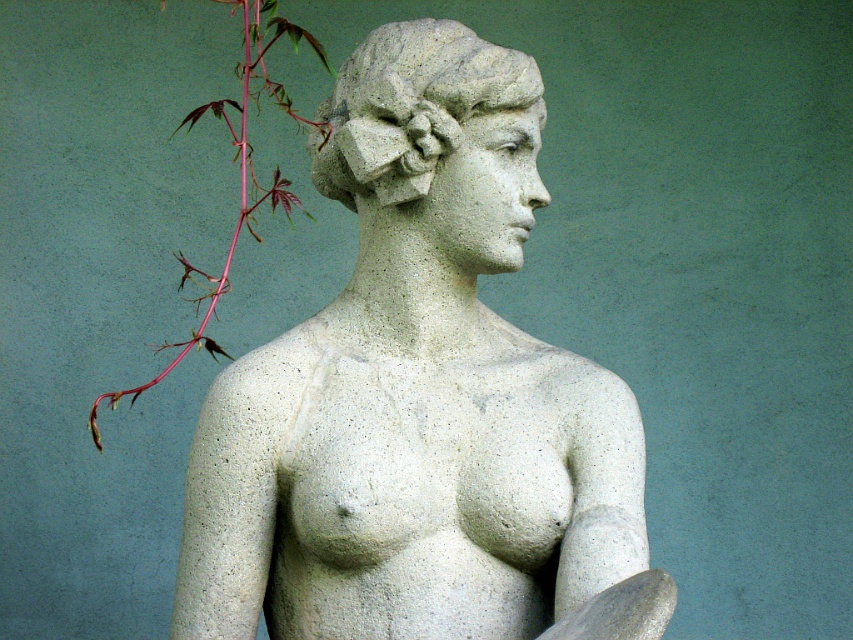
You are an art curator preparing to display the white stone statue at center and the gray stone head at center in a gallery. The gallery has a limited space where the statue must be placed behind the head. Can you arrange them so that the larger object is behind the smaller one without blocking the view of both?

The white stone statue at center is larger than the gray stone head at center. To ensure both are visible, place the smaller gray stone head at center closer to the front and the larger white stone statue at center slightly behind but positioned to not fully obscure the head.

You are an art conservator examining the sculpture. You notice two points on the statue that need restoration. The first point is at coordinate point (x=395, y=260) and the second is at point (x=271, y=3). Which point is closer to the surface you are working on?

Point (x=395, y=260) is further to the camera than point (x=271, y=3), so the point closer to the surface you are working on is point (x=271, y=3).